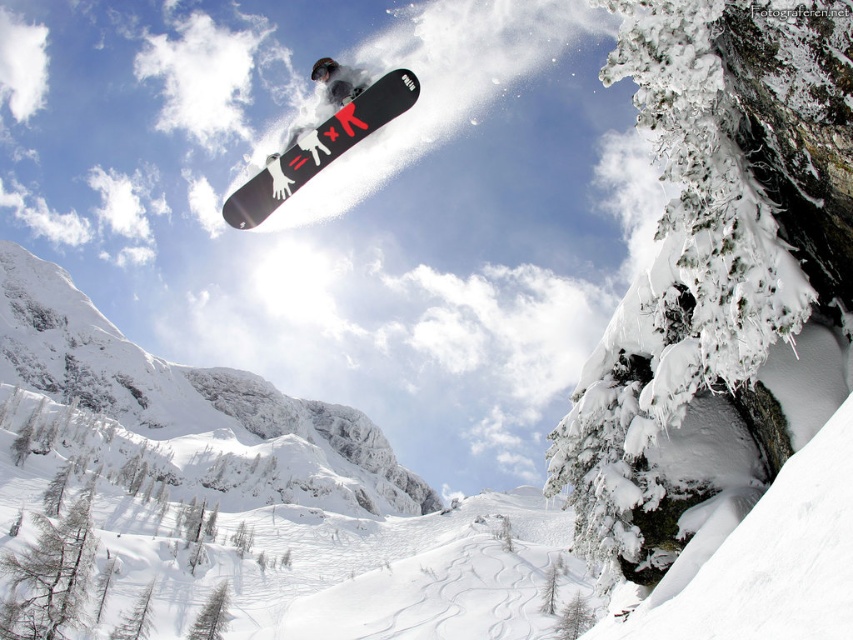
Does black matte snowboard at center have a smaller size compared to black matte snowboarder at center?

Indeed, black matte snowboard at center has a smaller size compared to black matte snowboarder at center.

Which of these two, black matte snowboard at center or black matte snowboarder at center, stands shorter?

black matte snowboard at center is shorter.

I want to click on black matte snowboard at center, so click(x=318, y=147).